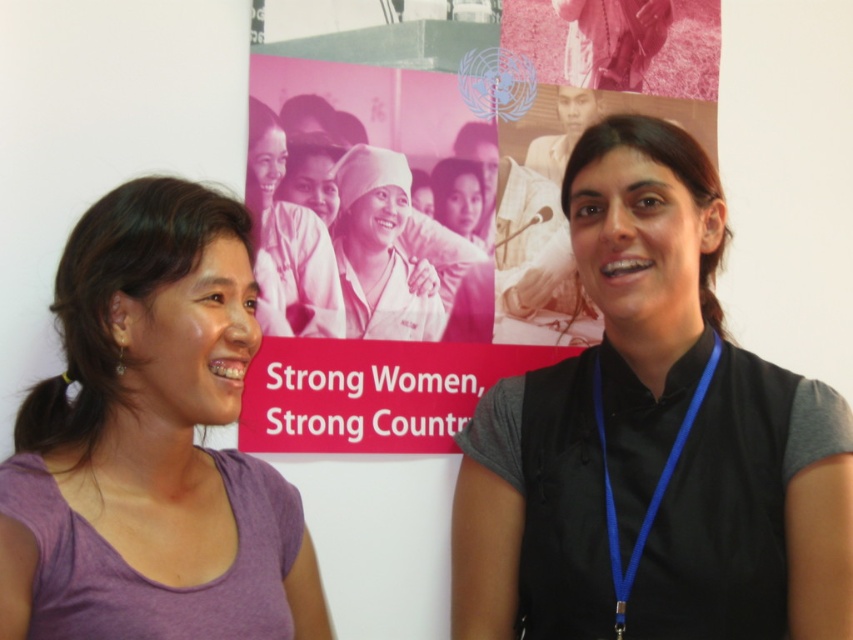
Question: Which object appears closest to the camera in this image?

Choices:
 (A) purple cotton t-shirt at left
 (B) black fabric vest at center
 (C) pink glossy poster at center
 (D) blue fabric lanyard at right

Answer: (A)

Question: Among these objects, which one is nearest to the camera?

Choices:
 (A) white cotton hat at center
 (B) blue fabric lanyard at right
 (C) matte pink uniform at center

Answer: (B)

Question: Observing the image, what is the correct spatial positioning of black fabric vest at center in reference to purple cotton t-shirt at left?

Choices:
 (A) below
 (B) above

Answer: (B)

Question: Which of the following is the closest to the observer?

Choices:
 (A) (74, 458)
 (B) (662, 438)
 (C) (345, 209)

Answer: (A)

Question: Is black fabric vest at center thinner than white cotton hat at center?

Choices:
 (A) yes
 (B) no

Answer: (B)

Question: Can you confirm if black fabric vest at center is positioned above blue fabric lanyard at right?

Choices:
 (A) yes
 (B) no

Answer: (A)